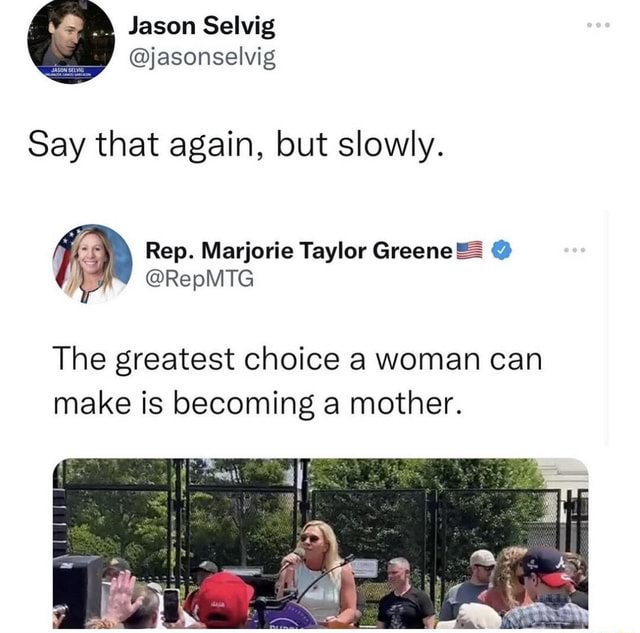
Where is `phone`? This screenshot has height=633, width=640. phone is located at coordinates (172, 606).